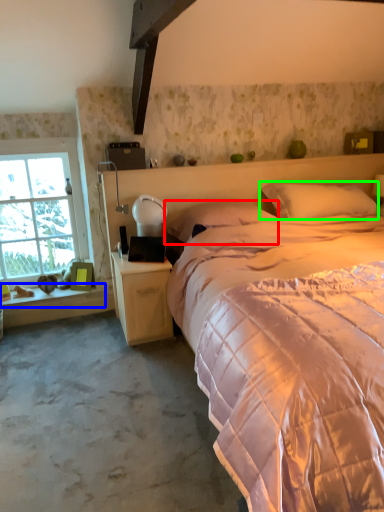
Question: Based on their relative distances, which object is farther from pillow (highlighted by a red box)? Choose from window sill (highlighted by a blue box) and pillow (highlighted by a green box).

Choices:
 (A) window sill
 (B) pillow

Answer: (A)